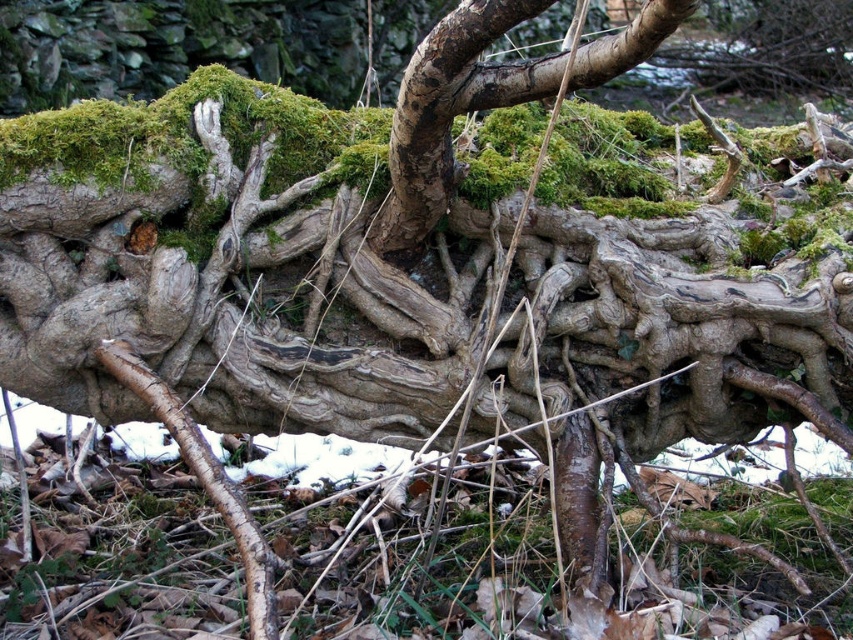
Question: Can you confirm if green mossy bark at center is bigger than barky brown root at lower left?

Choices:
 (A) yes
 (B) no

Answer: (B)

Question: Observing the image, what is the correct spatial positioning of green mossy bark at center in reference to barky brown root at lower left?

Choices:
 (A) above
 (B) below

Answer: (A)

Question: Which of the following is the farthest from the observer?

Choices:
 (A) (228, 490)
 (B) (495, 16)

Answer: (A)

Question: Which point is farther from the camera taking this photo?

Choices:
 (A) coord(405,77)
 (B) coord(259,540)

Answer: (B)

Question: Observing the image, what is the correct spatial positioning of green mossy bark at center in reference to barky brown root at lower left?

Choices:
 (A) right
 (B) left

Answer: (A)

Question: Among these points, which one is nearest to the camera?

Choices:
 (A) (479, 51)
 (B) (265, 545)

Answer: (A)